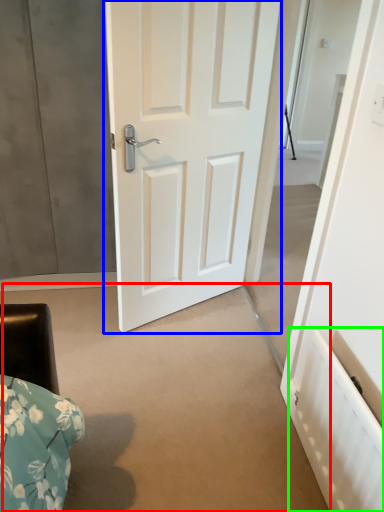
Question: Estimate the real-world distances between objects in this image. Which object is closer to concrete (highlighted by a red box), door (highlighted by a blue box) or radiator (highlighted by a green box)?

Choices:
 (A) door
 (B) radiator

Answer: (B)